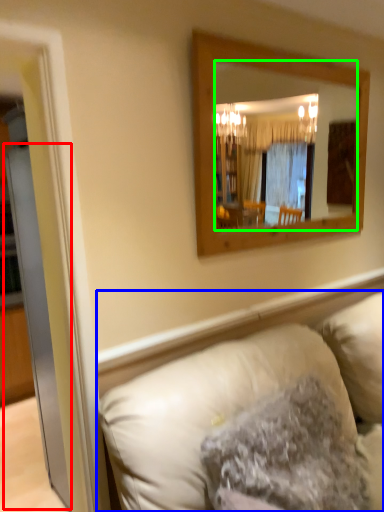
Question: Based on their relative distances, which object is farther from glass door (highlighted by a red box)? Choose from studio couch (highlighted by a blue box) and mirror (highlighted by a green box).

Choices:
 (A) studio couch
 (B) mirror

Answer: (B)